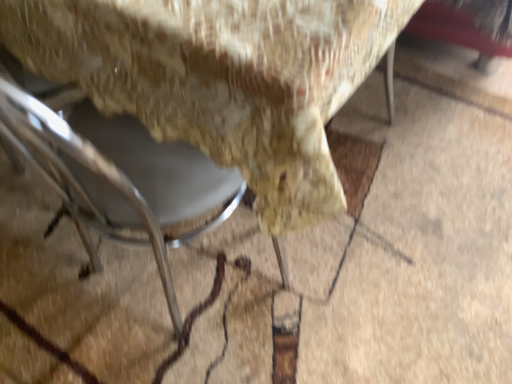
Question: From the image's perspective, relative to metallic gray chair at lower left, which appears as the second chair when viewed from the left, is metallic gray chair at lower left, the second chair from the right, above or below?

Choices:
 (A) above
 (B) below

Answer: (B)

Question: Is point (54, 135) closer or farther from the camera than point (252, 67)?

Choices:
 (A) farther
 (B) closer

Answer: (A)

Question: In the image, is metallic gray chair at lower left, the 1th chair when ordered from left to right, positioned in front of or behind metallic gray chair at lower left, which is counted as the first chair, starting from the right?

Choices:
 (A) front
 (B) behind

Answer: (A)

Question: Which is correct: metallic gray chair at lower left, which appears as the second chair when viewed from the left, is inside metallic gray chair at lower left, the second chair from the right, or outside of it?

Choices:
 (A) outside
 (B) inside

Answer: (A)

Question: Considering the positions of metallic gray chair at lower left, which is counted as the first chair, starting from the right, and metallic gray chair at lower left, the 1th chair when ordered from left to right, in the image, is metallic gray chair at lower left, which is counted as the first chair, starting from the right, taller or shorter than metallic gray chair at lower left, the 1th chair when ordered from left to right,?

Choices:
 (A) short
 (B) tall

Answer: (A)

Question: Based on their positions, is metallic gray chair at lower left, which is counted as the first chair, starting from the right, located to the left or right of metallic gray chair at lower left, the 1th chair when ordered from left to right?

Choices:
 (A) left
 (B) right

Answer: (B)

Question: Is metallic gray chair at lower left, which appears as the second chair when viewed from the left, wider or thinner than metallic gray chair at lower left, the second chair from the right?

Choices:
 (A) thin
 (B) wide

Answer: (B)